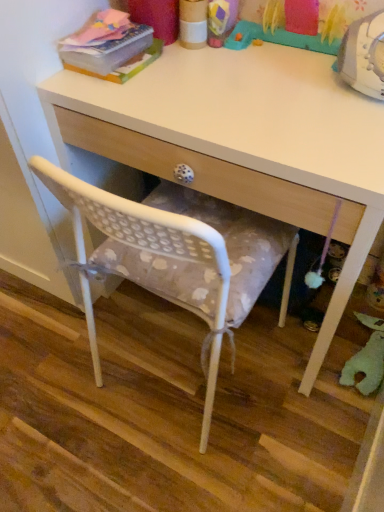
Question: Looking at their shapes, would you say matte pink book at upper left is wider or thinner than white fabric cushion at center?

Choices:
 (A) wide
 (B) thin

Answer: (B)

Question: In the image, is matte pink book at upper left on the left side or the right side of white fabric cushion at center?

Choices:
 (A) left
 (B) right

Answer: (A)

Question: Which of these objects is positioned closest to the plastic toy at upper center, the second toy from the right?

Choices:
 (A) matte pink book at upper left
 (B) white fabric cushion at center
 (C) white wood desk at center
 (D) green felt toy at lower right, placed as the second toy when sorted from front to back

Answer: (A)

Question: Estimate the real-world distances between objects in this image. Which object is farther from the plastic toy at upper center, the first toy viewed from the top?

Choices:
 (A) matte pink book at upper left
 (B) white wood desk at center
 (C) white fabric cushion at center
 (D) green felt toy at lower right, placed as the second toy when sorted from front to back

Answer: (C)